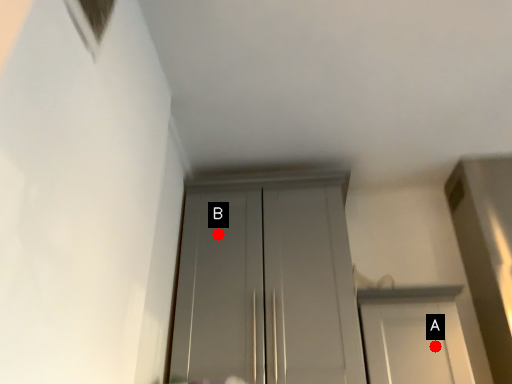
Question: Two points are circled on the image, labeled by A and B beside each circle. Which point is farther from the camera taking this photo?

Choices:
 (A) A is further
 (B) B is further

Answer: (B)